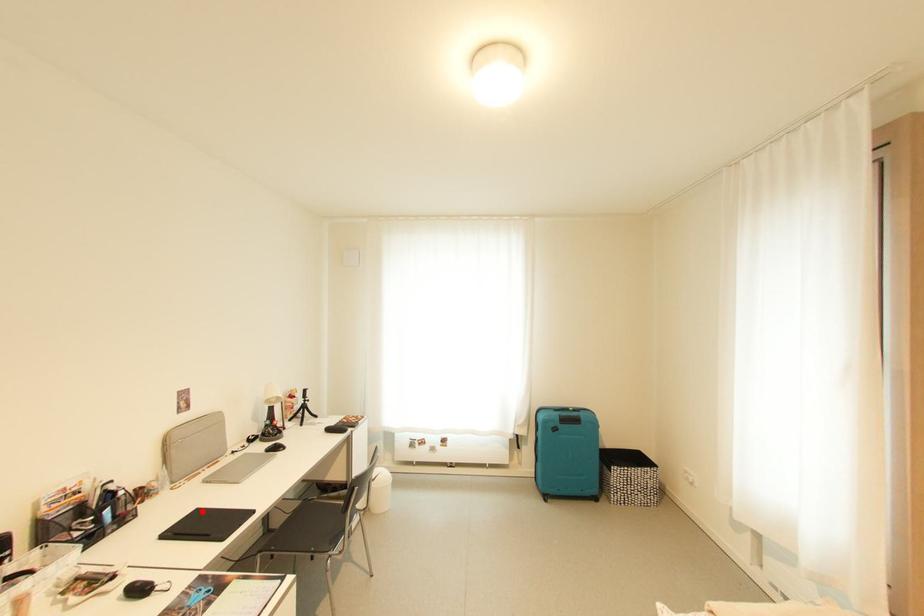
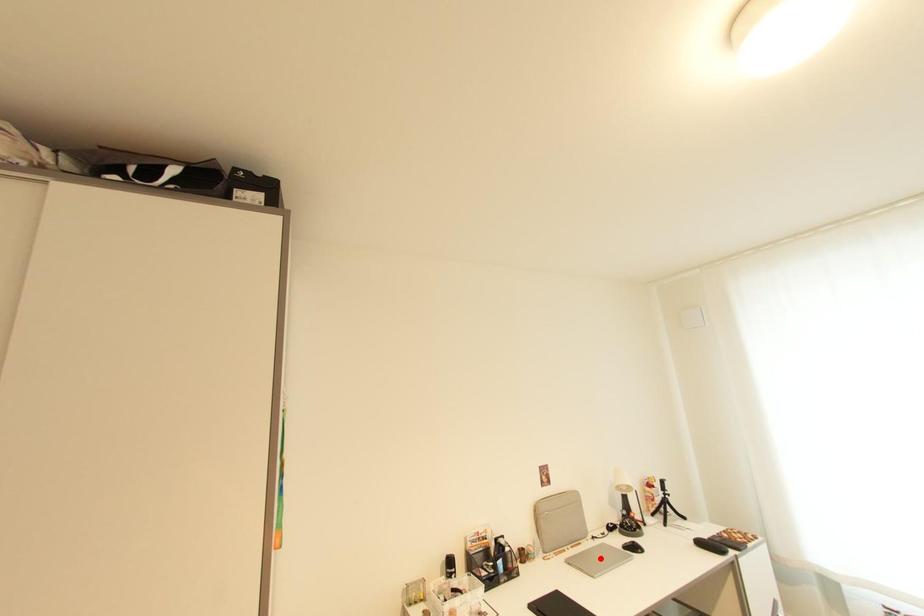
I am providing you with two images of the same scene from different viewpoints. A red point is marked on the first image and another point is marked on the second image. Are the points marked in image1 and image2 representing the same 3D position?

No